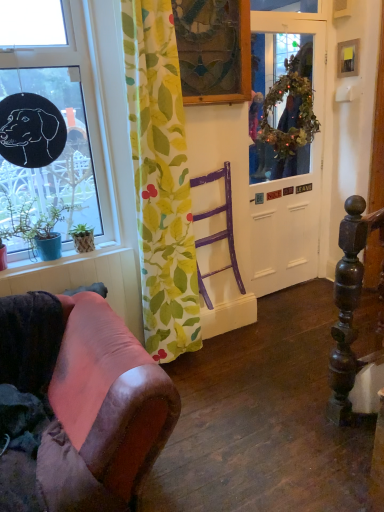
Locate an element on the screen. free region under stained glass picture frame at upper center, which is the second picture frame in back-to-front order (from a real-world perspective) is located at coordinates (210, 161).